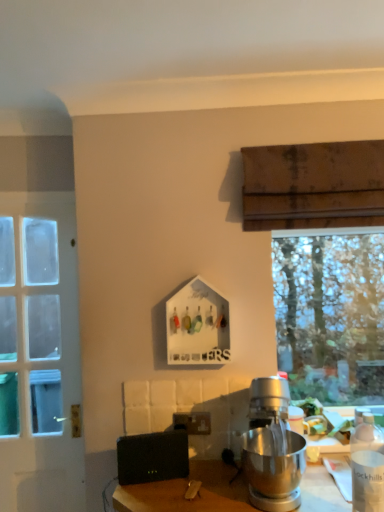
Question: Considering the positions of silver metallic stand mixer at center and matte black power outlet at center in the image, is silver metallic stand mixer at center bigger or smaller than matte black power outlet at center?

Choices:
 (A) small
 (B) big

Answer: (B)

Question: Is silver metallic stand mixer at center inside or outside of matte black power outlet at center?

Choices:
 (A) outside
 (B) inside

Answer: (A)

Question: Which is nearer to the white matte bottle at lower right?

Choices:
 (A) silver metallic stand mixer at center
 (B) matte black power outlet at center
 (C) white glass door at left
 (D) black matte speaker at lower center

Answer: (A)

Question: Which object is the farthest from the white matte bottle at lower right?

Choices:
 (A) black matte speaker at lower center
 (B) silver metallic stand mixer at center
 (C) matte black power outlet at center
 (D) white glass door at left

Answer: (D)